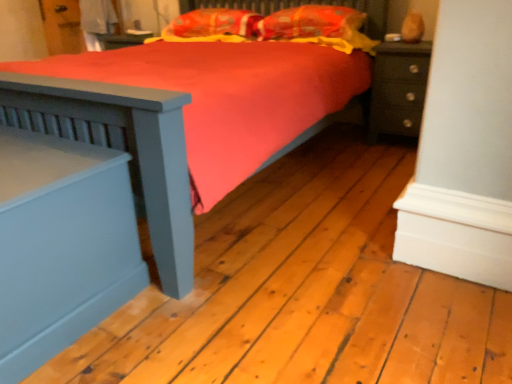
Image resolution: width=512 pixels, height=384 pixels. Describe the element at coordinates (398, 89) in the screenshot. I see `matte dark green nightstand at right, which is the second nightstand from left to right` at that location.

What do you see at coordinates (311, 23) in the screenshot? The height and width of the screenshot is (384, 512). I see `orange fabric pillow at upper center, which is counted as the second pillow, starting from the left` at bounding box center [311, 23].

How much space does orange fabric pillow at upper center, arranged as the 1th pillow when viewed from the right, occupy horizontally?

orange fabric pillow at upper center, arranged as the 1th pillow when viewed from the right, is 14.82 inches wide.

Find the location of `orange fabric pillow at upper center, the 1th pillow in the left-to-right sequence`. orange fabric pillow at upper center, the 1th pillow in the left-to-right sequence is located at coordinates (214, 24).

Is orange fabric pillow at upper center, arranged as the 1th pillow when viewed from the right, wider or thinner than matte dark green nightstand at right, which is the second nightstand in front-to-back order?

Considering their sizes, orange fabric pillow at upper center, arranged as the 1th pillow when viewed from the right, looks slimmer than matte dark green nightstand at right, which is the second nightstand in front-to-back order.

From the matte dark green nightstand at right, which is the second nightstand in front-to-back order, count 1st pillows backward and point to it. Please provide its 2D coordinates.

[(311, 23)]

Is orange fabric pillow at upper center, arranged as the 1th pillow when viewed from the right, directly adjacent to matte dark green nightstand at right, the first nightstand viewed from the right?

No, orange fabric pillow at upper center, arranged as the 1th pillow when viewed from the right, is not making contact with matte dark green nightstand at right, the first nightstand viewed from the right.

Do you think matte blue nightstand at left, acting as the 2th nightstand starting from the right, is within matte dark green nightstand at right, the second nightstand ordered from the bottom, or outside of it?

The correct answer is: outside.

Could you tell me if matte blue nightstand at left, the first nightstand when ordered from front to back, is facing matte dark green nightstand at right, which is the second nightstand in front-to-back order?

No, matte blue nightstand at left, the first nightstand when ordered from front to back, is not facing towards matte dark green nightstand at right, which is the second nightstand in front-to-back order.

Who is bigger, matte blue nightstand at left, the 2th nightstand when ordered from top to bottom, or matte dark green nightstand at right, which is the second nightstand in front-to-back order?

With larger size is matte blue nightstand at left, the 2th nightstand when ordered from top to bottom.

Who is more distant, matte blue nightstand at left, acting as the 2th nightstand starting from the right, or orange fabric pillow at upper center, the 1th pillow in the left-to-right sequence?

orange fabric pillow at upper center, the 1th pillow in the left-to-right sequence, is more distant.

Which is correct: matte blue nightstand at left, which is counted as the first nightstand, starting from the bottom, is inside orange fabric pillow at upper center, which appears as the 2th pillow when viewed from the right, or outside of it?

The correct answer is: outside.

Looking at this image, is matte blue nightstand at left, the first nightstand when ordered from front to back, far away from orange fabric pillow at upper center, which appears as the 2th pillow when viewed from the right?

That's right, there is a large distance between matte blue nightstand at left, the first nightstand when ordered from front to back, and orange fabric pillow at upper center, which appears as the 2th pillow when viewed from the right.

Which object is thinner, matte blue nightstand at left, which ranks as the second nightstand in back-to-front order, or orange fabric pillow at upper center, the 1th pillow in the left-to-right sequence?

orange fabric pillow at upper center, the 1th pillow in the left-to-right sequence, is thinner.

Between orange fabric pillow at upper center, which is counted as the second pillow, starting from the left, and matte blue nightstand at left, the first nightstand when ordered from front to back, which one has larger width?

matte blue nightstand at left, the first nightstand when ordered from front to back, is wider.

Which of these two, orange fabric pillow at upper center, arranged as the 1th pillow when viewed from the right, or matte blue nightstand at left, which is counted as the first nightstand, starting from the left, is smaller?

Smaller between the two is orange fabric pillow at upper center, arranged as the 1th pillow when viewed from the right.

Visually, is orange fabric pillow at upper center, arranged as the 1th pillow when viewed from the right, positioned to the left or to the right of matte blue nightstand at left, acting as the 2th nightstand starting from the right?

Based on their positions, orange fabric pillow at upper center, arranged as the 1th pillow when viewed from the right, is located to the right of matte blue nightstand at left, acting as the 2th nightstand starting from the right.

In the scene shown: Which point is more forward, (291,26) or (91,247)?

The point (91,247) is closer to the camera.

This screenshot has width=512, height=384. What are the coordinates of `the 1st nightstand in front when counting from the orange fabric pillow at upper center, which appears as the 2th pillow when viewed from the right` in the screenshot? It's located at pos(398,89).

From the image's perspective, who appears lower, orange fabric pillow at upper center, which appears as the 2th pillow when viewed from the right, or matte dark green nightstand at right, the first nightstand viewed from the right?

matte dark green nightstand at right, the first nightstand viewed from the right, from the image's perspective.

From the picture: Is orange fabric pillow at upper center, the 1th pillow in the left-to-right sequence, far from matte dark green nightstand at right, the first nightstand viewed from the right?

Yes, orange fabric pillow at upper center, the 1th pillow in the left-to-right sequence, and matte dark green nightstand at right, the first nightstand viewed from the right, are located far from each other.

Between matte dark green nightstand at right, the second nightstand ordered from the bottom, and orange fabric pillow at upper center, arranged as the 1th pillow when viewed from the right, which one has less height?

Standing shorter between the two is orange fabric pillow at upper center, arranged as the 1th pillow when viewed from the right.

Is matte dark green nightstand at right, the second nightstand ordered from the bottom, facing away from orange fabric pillow at upper center, which is counted as the second pillow, starting from the left?

No, orange fabric pillow at upper center, which is counted as the second pillow, starting from the left, is not at the back of matte dark green nightstand at right, the second nightstand ordered from the bottom.

Is the surface of matte dark green nightstand at right, the 1th nightstand from the back, in direct contact with orange fabric pillow at upper center, arranged as the 1th pillow when viewed from the right?

They are not placed beside each other.

Could you measure the distance between matte dark green nightstand at right, the first nightstand viewed from the right, and orange fabric pillow at upper center, arranged as the 1th pillow when viewed from the right?

They are 18.25 inches apart.

From a real-world perspective, is matte dark green nightstand at right, which is the second nightstand in front-to-back order, on top of orange fabric pillow at upper center, which appears as the 2th pillow when viewed from the right?

No.

Considering the sizes of objects matte dark green nightstand at right, the first nightstand viewed from the right, and orange fabric pillow at upper center, which appears as the 2th pillow when viewed from the right, in the image provided, who is wider, matte dark green nightstand at right, the first nightstand viewed from the right, or orange fabric pillow at upper center, which appears as the 2th pillow when viewed from the right,?

orange fabric pillow at upper center, which appears as the 2th pillow when viewed from the right, is wider.

From the image's perspective, between matte dark green nightstand at right, the first nightstand from the top, and orange fabric pillow at upper center, the 1th pillow in the left-to-right sequence, who is located below?

matte dark green nightstand at right, the first nightstand from the top, is shown below in the image.

Choose the correct answer: Is matte dark green nightstand at right, the 1th nightstand from the back, inside orange fabric pillow at upper center, the 1th pillow in the left-to-right sequence, or outside it?

matte dark green nightstand at right, the 1th nightstand from the back, cannot be found inside orange fabric pillow at upper center, the 1th pillow in the left-to-right sequence.

You are a GUI agent. You are given a task and a screenshot of the screen. Output one action in this format:
    pyautogui.click(x=<x>, y=<y>)
    Task: Click on the nightstand that is the 1st one below the orange fabric pillow at upper center, arranged as the 1th pillow when viewed from the right (from a real-world perspective)
    This screenshot has height=384, width=512.
    Given the screenshot: What is the action you would take?
    pyautogui.click(x=398, y=89)

Where is `nightstand in front of the matte dark green nightstand at right, which is the second nightstand in front-to-back order`? This screenshot has height=384, width=512. nightstand in front of the matte dark green nightstand at right, which is the second nightstand in front-to-back order is located at coordinates (61, 245).

Estimate the real-world distances between objects in this image. Which object is further from orange fabric pillow at upper center, which is counted as the second pillow, starting from the left, matte dark green nightstand at right, which is the second nightstand in front-to-back order, or orange fabric pillow at upper center, which appears as the 2th pillow when viewed from the right?

matte dark green nightstand at right, which is the second nightstand in front-to-back order, lies further to orange fabric pillow at upper center, which is counted as the second pillow, starting from the left, than the other object.

From the image, which object appears to be nearer to orange fabric pillow at upper center, arranged as the 1th pillow when viewed from the right, matte blue nightstand at left, the first nightstand when ordered from front to back, or orange fabric pillow at upper center, which appears as the 2th pillow when viewed from the right?

Among the two, orange fabric pillow at upper center, which appears as the 2th pillow when viewed from the right, is located nearer to orange fabric pillow at upper center, arranged as the 1th pillow when viewed from the right.

When comparing their distances from matte dark green nightstand at right, the second nightstand ordered from the bottom, does matte blue nightstand at left, the 2th nightstand when ordered from top to bottom, or orange fabric pillow at upper center, which appears as the 2th pillow when viewed from the right, seem further?

matte blue nightstand at left, the 2th nightstand when ordered from top to bottom, is further to matte dark green nightstand at right, the second nightstand ordered from the bottom.

Estimate the real-world distances between objects in this image. Which object is closer to matte dark green nightstand at right, which is the second nightstand from left to right, orange fabric pillow at upper center, which appears as the 2th pillow when viewed from the right, or orange fabric pillow at upper center, which is counted as the second pillow, starting from the left?

The object closer to matte dark green nightstand at right, which is the second nightstand from left to right, is orange fabric pillow at upper center, which is counted as the second pillow, starting from the left.

Which object lies further to the anchor point matte dark green nightstand at right, the second nightstand ordered from the bottom, orange fabric pillow at upper center, which is counted as the second pillow, starting from the left, or matte blue nightstand at left, acting as the 2th nightstand starting from the right?

matte blue nightstand at left, acting as the 2th nightstand starting from the right, is further to matte dark green nightstand at right, the second nightstand ordered from the bottom.

Based on their spatial positions, is matte dark green nightstand at right, which is the second nightstand in front-to-back order, or matte blue nightstand at left, acting as the 2th nightstand starting from the right, further from orange fabric pillow at upper center, the 1th pillow in the left-to-right sequence?

The object further to orange fabric pillow at upper center, the 1th pillow in the left-to-right sequence, is matte blue nightstand at left, acting as the 2th nightstand starting from the right.

From the image, which object appears to be farther from orange fabric pillow at upper center, which is counted as the second pillow, starting from the left, matte blue nightstand at left, the first nightstand when ordered from front to back, or matte dark green nightstand at right, the second nightstand ordered from the bottom?

matte blue nightstand at left, the first nightstand when ordered from front to back, lies further to orange fabric pillow at upper center, which is counted as the second pillow, starting from the left, than the other object.

From the image, which object appears to be farther from orange fabric pillow at upper center, which appears as the 2th pillow when viewed from the right, orange fabric pillow at upper center, arranged as the 1th pillow when viewed from the right, or matte dark green nightstand at right, the 1th nightstand from the back?

Among the two, matte dark green nightstand at right, the 1th nightstand from the back, is located further to orange fabric pillow at upper center, which appears as the 2th pillow when viewed from the right.

You are a GUI agent. You are given a task and a screenshot of the screen. Output one action in this format:
    pyautogui.click(x=<x>, y=<y>)
    Task: Click on the pillow between orange fabric pillow at upper center, the 1th pillow in the left-to-right sequence, and matte dark green nightstand at right, the first nightstand from the top
    
    Given the screenshot: What is the action you would take?
    pyautogui.click(x=311, y=23)

Locate an element on the screen. This screenshot has width=512, height=384. pillow located between matte blue nightstand at left, acting as the 2th nightstand starting from the right, and orange fabric pillow at upper center, which appears as the 2th pillow when viewed from the right, in the depth direction is located at coordinates (311, 23).

Identify the location of nightstand positioned between matte blue nightstand at left, which is counted as the first nightstand, starting from the left, and orange fabric pillow at upper center, which appears as the 2th pillow when viewed from the right, from near to far. The width and height of the screenshot is (512, 384). (398, 89).